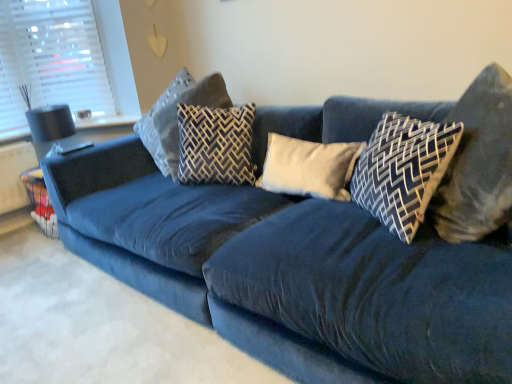
Question: Can you confirm if dark blue fabric pillow at upper right, which is the first pillow from right to left, is taller than dark gray fabric pillow at center, which is the first pillow from left to right?

Choices:
 (A) yes
 (B) no

Answer: (B)

Question: Is dark blue fabric pillow at upper right, which is the first pillow from right to left, not within dark gray fabric pillow at center, which is the first pillow from left to right?

Choices:
 (A) no
 (B) yes

Answer: (B)

Question: Does dark blue fabric pillow at upper right, positioned as the fifth pillow in left-to-right order, come behind dark gray fabric pillow at center, acting as the 5th pillow starting from the right?

Choices:
 (A) no
 (B) yes

Answer: (A)

Question: Is dark blue fabric pillow at upper right, which is the first pillow from right to left, facing away from dark gray fabric pillow at center, acting as the 5th pillow starting from the right?

Choices:
 (A) yes
 (B) no

Answer: (B)

Question: Is dark blue fabric pillow at upper right, which is the first pillow from right to left, placed right next to dark gray fabric pillow at center, which is the first pillow from left to right?

Choices:
 (A) no
 (B) yes

Answer: (A)

Question: In terms of size, does white soft cushion at center, acting as the 3th pillow starting from the left, appear bigger or smaller than patterned fabric pillow at center, the fourth pillow viewed from the right?

Choices:
 (A) small
 (B) big

Answer: (A)

Question: From the image's perspective, is white soft cushion at center, which is the third pillow from right to left, above or below patterned fabric pillow at center, marked as the 2th pillow in a left-to-right arrangement?

Choices:
 (A) below
 (B) above

Answer: (A)

Question: Is white soft cushion at center, which is the third pillow from right to left, to the left or to the right of patterned fabric pillow at center, marked as the 2th pillow in a left-to-right arrangement, in the image?

Choices:
 (A) left
 (B) right

Answer: (B)

Question: Considering the positions of white soft cushion at center, which is the third pillow from right to left, and patterned fabric pillow at center, the fourth pillow viewed from the right, in the image, is white soft cushion at center, which is the third pillow from right to left, taller or shorter than patterned fabric pillow at center, the fourth pillow viewed from the right,?

Choices:
 (A) tall
 (B) short

Answer: (B)

Question: From the image's perspective, is white plastic blinds at upper left located above or below dark blue fabric pillow at upper right, which is the first pillow from right to left?

Choices:
 (A) above
 (B) below

Answer: (A)

Question: Is white plastic blinds at upper left wider or thinner than dark blue fabric pillow at upper right, positioned as the fifth pillow in left-to-right order?

Choices:
 (A) thin
 (B) wide

Answer: (A)

Question: Considering the positions of white plastic blinds at upper left and dark blue fabric pillow at upper right, positioned as the fifth pillow in left-to-right order, in the image, is white plastic blinds at upper left taller or shorter than dark blue fabric pillow at upper right, positioned as the fifth pillow in left-to-right order,?

Choices:
 (A) short
 (B) tall

Answer: (B)

Question: Considering the positions of point (19, 69) and point (462, 210), is point (19, 69) closer or farther from the camera than point (462, 210)?

Choices:
 (A) farther
 (B) closer

Answer: (A)

Question: From their relative heights in the image, would you say white plastic blinds at upper left is taller or shorter than dark gray fabric pillow at center, which is the first pillow from left to right?

Choices:
 (A) tall
 (B) short

Answer: (A)

Question: Is point (31, 39) positioned closer to the camera than point (220, 81)?

Choices:
 (A) closer
 (B) farther

Answer: (B)